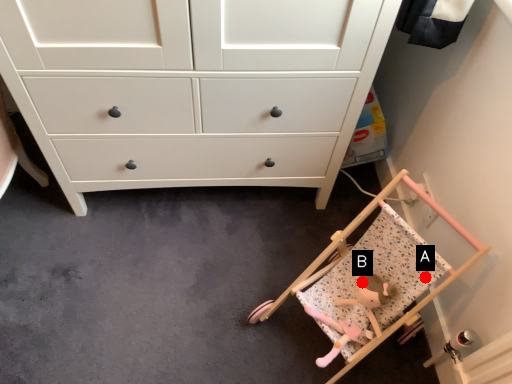
Question: Two points are circled on the image, labeled by A and B beside each circle. Which point appears farthest from the camera in this image?

Choices:
 (A) A is further
 (B) B is further

Answer: (B)